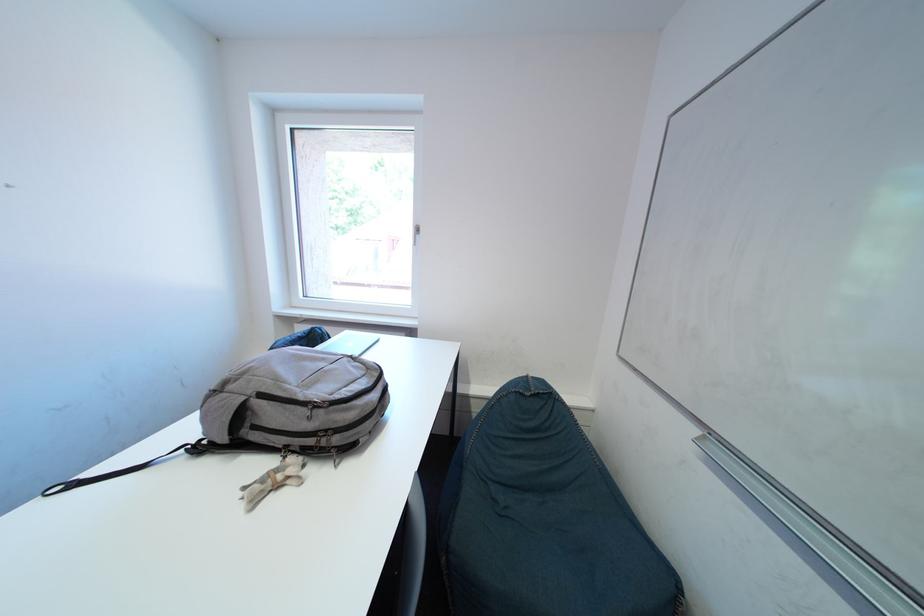
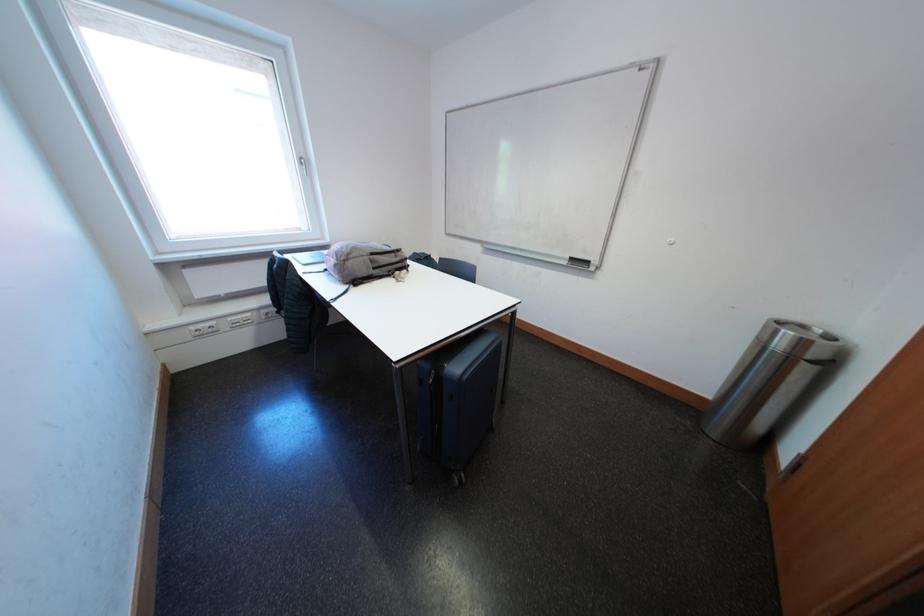
Where in the second image is the point corresponding to (x=320, y=421) from the first image?

(406, 261)